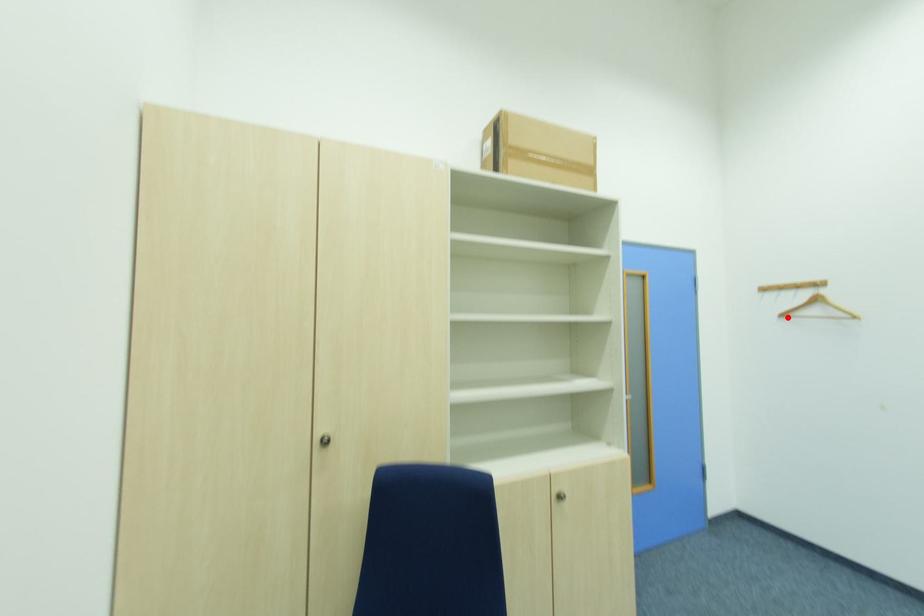
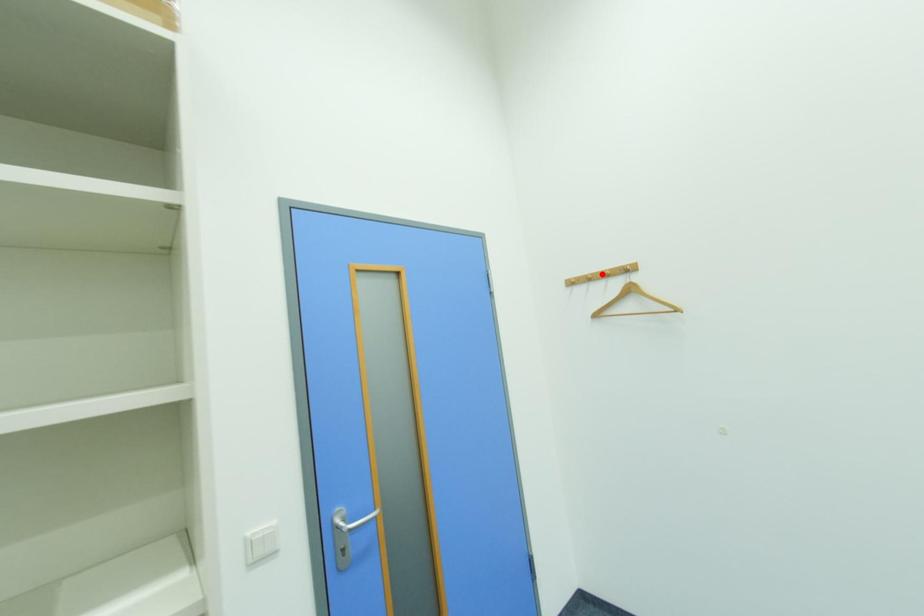
I am providing you with two images of the same scene from different viewpoints. A red point is marked on the first image and another point is marked on the second image. Does the point marked in image1 correspond to the same location as the one in image2?

No